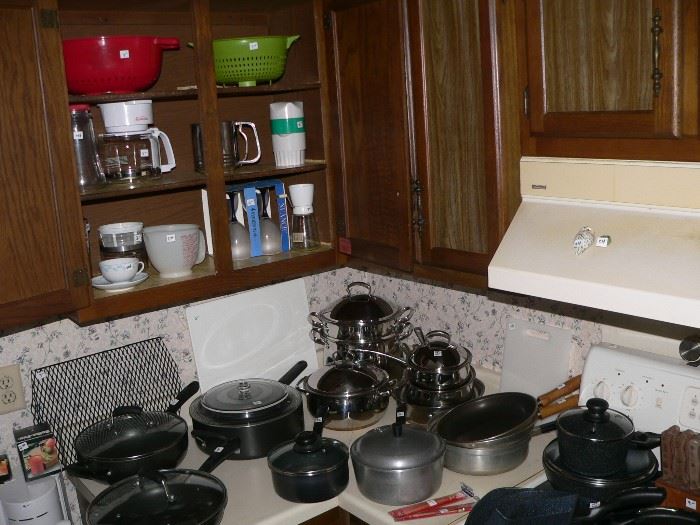
I want to click on range, so click(664, 408).